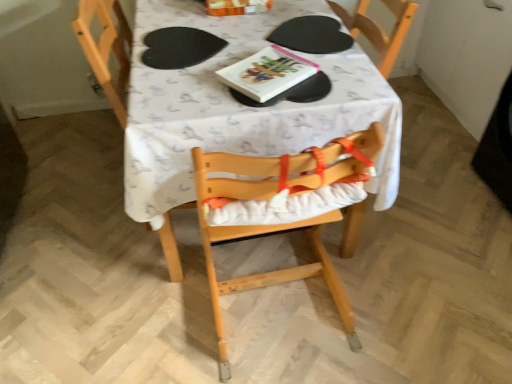
At what (x,y) coordinates should I click in order to perform the action: click on free location to the left of white fabric table at center. Please return your answer as a coordinate pair (x, y). The image size is (512, 384). Looking at the image, I should click on (70, 196).